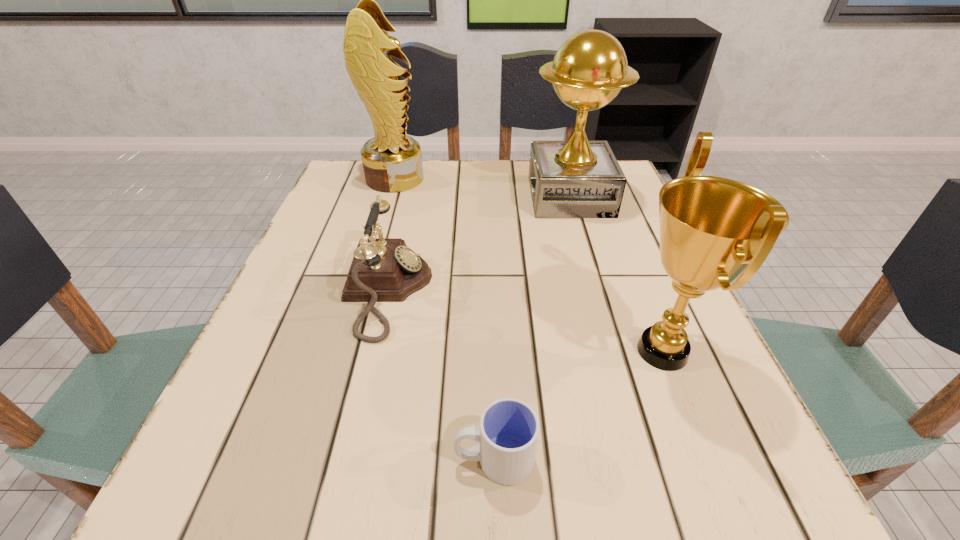
Where is `vacant point located 0.050m with the handle on the side of the third object from left to right`? vacant point located 0.050m with the handle on the side of the third object from left to right is located at coordinates coord(418,459).

Find the location of a particular element. This screenshot has width=960, height=540. free space located 0.220m with the handle on the side of the third object from left to right is located at coordinates (291, 459).

Identify the location of blank space located with the handle on the side of the third object from left to right. (299, 459).

Where is `object present at the near edge`? The height and width of the screenshot is (540, 960). object present at the near edge is located at coordinates (508, 433).

Image resolution: width=960 pixels, height=540 pixels. Find the location of `award at the left edge`. award at the left edge is located at coordinates (392, 161).

This screenshot has width=960, height=540. What are the coordinates of `telephone positioned at the left edge` in the screenshot? It's located at (383, 269).

The image size is (960, 540). What are the coordinates of `object at the far left corner` in the screenshot? It's located at (392, 161).

Image resolution: width=960 pixels, height=540 pixels. Find the location of `object present at the far right corner`. object present at the far right corner is located at coordinates (577, 178).

Identify the location of free region at the far edge. The width and height of the screenshot is (960, 540). (446, 190).

Find the location of a particular element. The image size is (960, 540). vacant space at the left edge of the desktop is located at coordinates (272, 443).